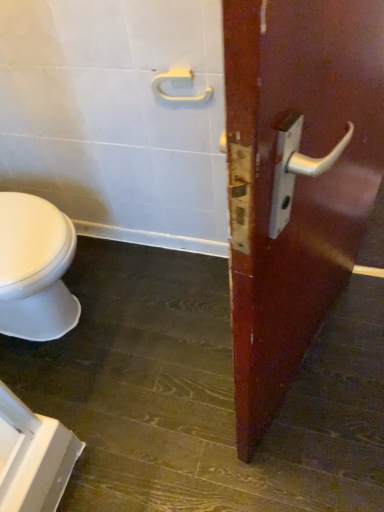
Where is `wooden door handle at right`? The image size is (384, 512). wooden door handle at right is located at coordinates (295, 180).

Describe the element at coordinates (295, 180) in the screenshot. I see `wooden door handle at right` at that location.

At what (x,y) coordinates should I click in order to perform the action: click on wooden door handle at right. Please return your answer as a coordinate pair (x, y). Looking at the image, I should click on (295, 180).